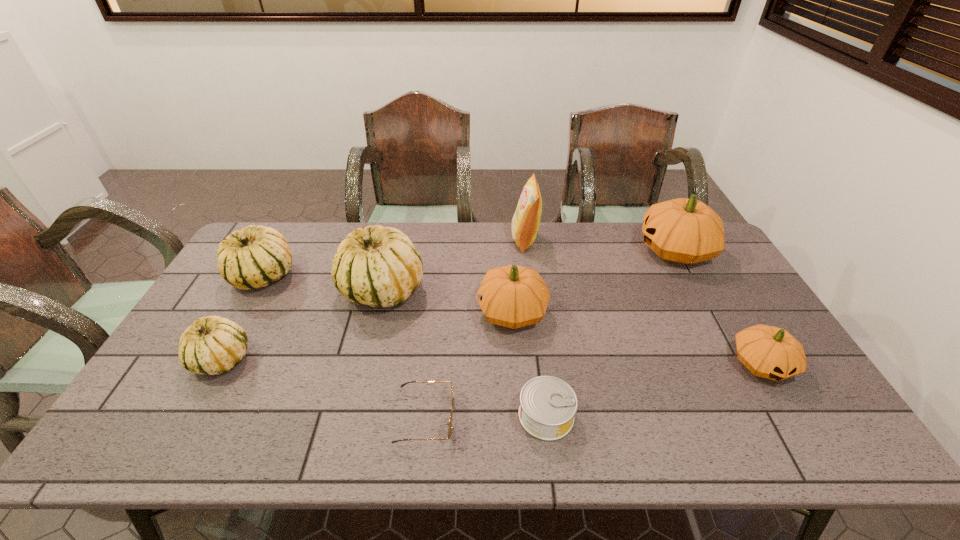
The height and width of the screenshot is (540, 960). Identify the location of the second closest white gourd to the biggest orange gourd. (254, 257).

Select which white gourd is the third closest to the biggest orange gourd. Please provide its 2D coordinates. Your answer should be formatted as a tuple, i.e. [(x, y)], where the tuple contains the x and y coordinates of a point satisfying the conditions above.

[(213, 345)]

Locate an element on the screen. vacant space that satisfies the following two spatial constraints: 1. on the front-facing side of the crisp (potato chip); 2. on the front side of the rightmost white gourd is located at coordinates (532, 291).

The height and width of the screenshot is (540, 960). Identify the location of vacant space that satisfies the following two spatial constraints: 1. on the front side of the rightmost white gourd; 2. on the right side of the second smallest white gourd. (255, 291).